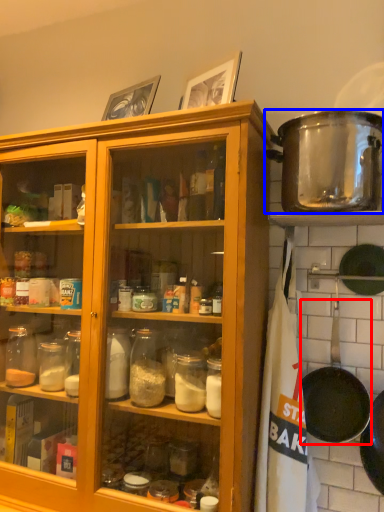
Question: Which point is further to the camera, frying pan (highlighted by a red box) or pot/pan (highlighted by a blue box)?

Choices:
 (A) frying pan
 (B) pot/pan

Answer: (A)